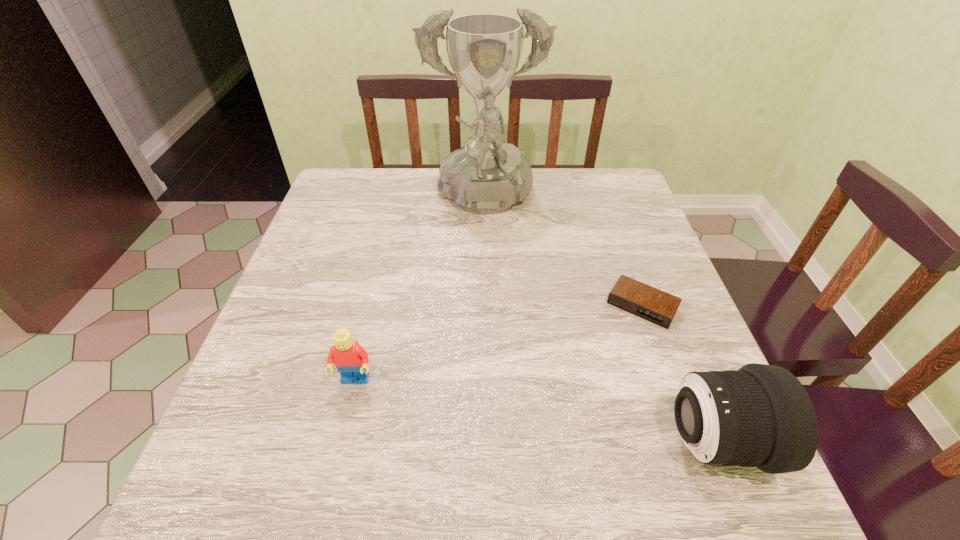
Locate an element on the screen. The image size is (960, 540). vacant area located 0.140m on the front face of the alarm clock is located at coordinates coord(602,372).

Where is `vacant space positioned on the side with emblem of the tallest object`? The width and height of the screenshot is (960, 540). vacant space positioned on the side with emblem of the tallest object is located at coordinates (491, 265).

Where is `free region located on the side with emblem of the tallest object`? This screenshot has width=960, height=540. free region located on the side with emblem of the tallest object is located at coordinates coord(492,279).

Locate an element on the screen. This screenshot has height=540, width=960. vacant region located 0.350m on the side with emblem of the tallest object is located at coordinates (498, 348).

This screenshot has height=540, width=960. I want to click on object located in the far edge section of the desktop, so click(x=486, y=176).

You are a GUI agent. You are given a task and a screenshot of the screen. Output one action in this format:
    pyautogui.click(x=<x>, y=<y>)
    Task: Click on the object that is positioned at the near edge
    This screenshot has height=540, width=960.
    Given the screenshot: What is the action you would take?
    pyautogui.click(x=761, y=416)

In order to click on telephoto lens that is at the right edge in this screenshot , I will do `click(761, 416)`.

What are the coordinates of `alarm clock that is positioned at the right edge` in the screenshot? It's located at (656, 306).

You are a GUI agent. You are given a task and a screenshot of the screen. Output one action in this format:
    pyautogui.click(x=<x>, y=<y>)
    Task: Click on the object located at the near right corner
    The image size is (960, 540).
    Given the screenshot: What is the action you would take?
    pyautogui.click(x=761, y=416)

Identify the location of vacant space at the far edge. The height and width of the screenshot is (540, 960). (561, 173).